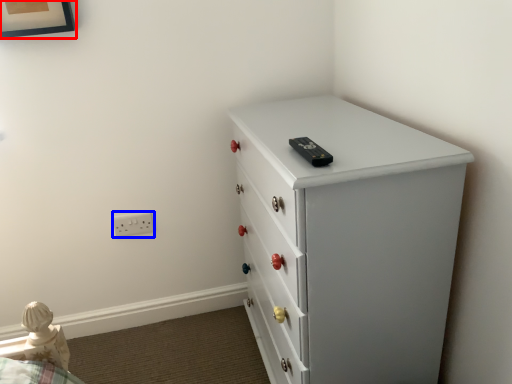
Question: Which object appears closest to the camera in this image, picture frame (highlighted by a red box) or electric outlet (highlighted by a blue box)?

Choices:
 (A) picture frame
 (B) electric outlet

Answer: (A)